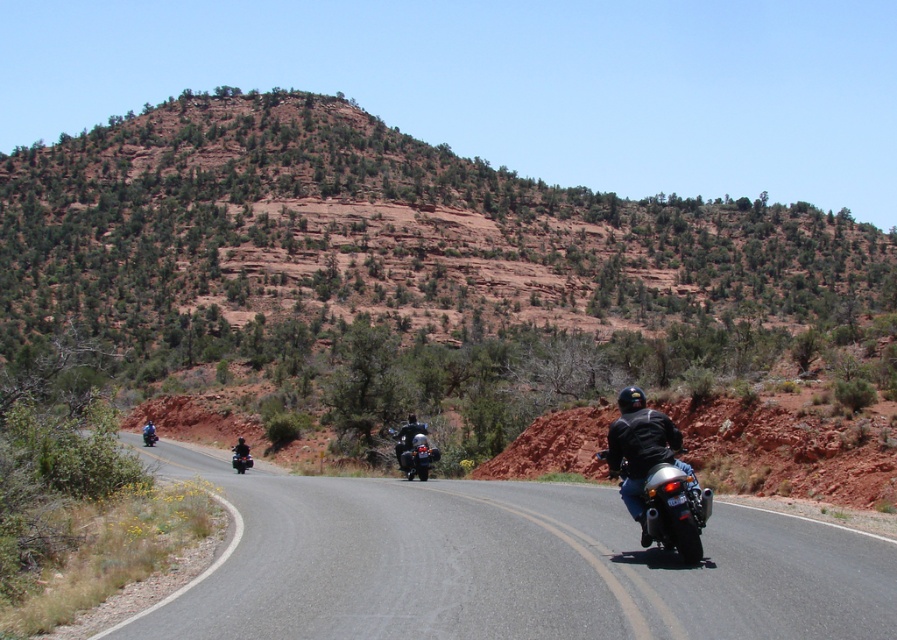
You are a photographer positioned at the starting point of the road. You see the black leather jacket at right and the dark gray leather jacket at center. Which jacket is closer to you?

The black leather jacket at right is closer to you because it is in front of the dark gray leather jacket at center.

You are a photographer trying to capture a wide shot of the black leather jacket at center and the shiny chrome motorcycle at center on the road. If your camera can only capture objects up to 1.5 meters wide, will both fit in the frame?

The black leather jacket at center is narrower than the shiny chrome motorcycle at center. Since the motorcycle is wider than the jacket, but the exact width of the motorcycle isn

You are a photographer positioned at the starting point of the road. You want to take a photo that captures both the shiny black motorcycle at center and the shiny chrome motorcycle at center in the same frame. Which motorcycle should you focus on first to ensure both are in the shot?

The shiny black motorcycle at center is in front of the shiny chrome motorcycle at center, so you should focus on the shiny black motorcycle at center first to ensure both are in the shot.